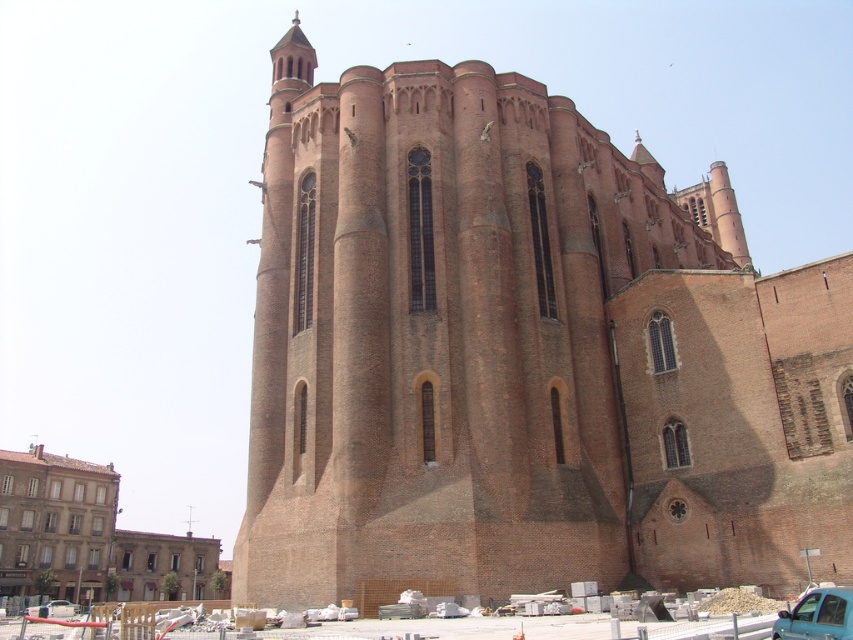
Question: Among these points, which one is farthest from the camera?

Choices:
 (A) coord(434,292)
 (B) coord(810,618)
 (C) coord(68,608)
 (D) coord(32,564)

Answer: (D)

Question: Which of the following is the farthest from the observer?

Choices:
 (A) teal matte car at lower right
 (B) brick church at center

Answer: (B)

Question: Observing the image, what is the correct spatial positioning of brown brick church at lower left in reference to teal matte car at lower right?

Choices:
 (A) right
 (B) left

Answer: (B)

Question: Is brick church at center positioned behind teal matte car at lower right?

Choices:
 (A) no
 (B) yes

Answer: (B)

Question: Does brick church at center have a greater width compared to brown brick church at lower left?

Choices:
 (A) no
 (B) yes

Answer: (A)

Question: Estimate the real-world distances between objects in this image. Which object is farther from the brown brick church at lower left?

Choices:
 (A) teal matte car at lower right
 (B) brick church at center

Answer: (A)